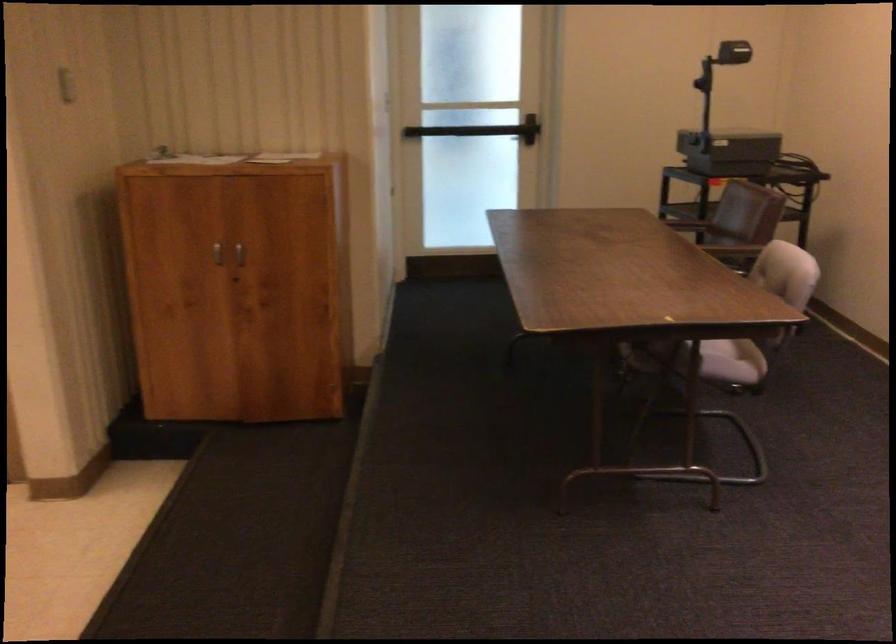
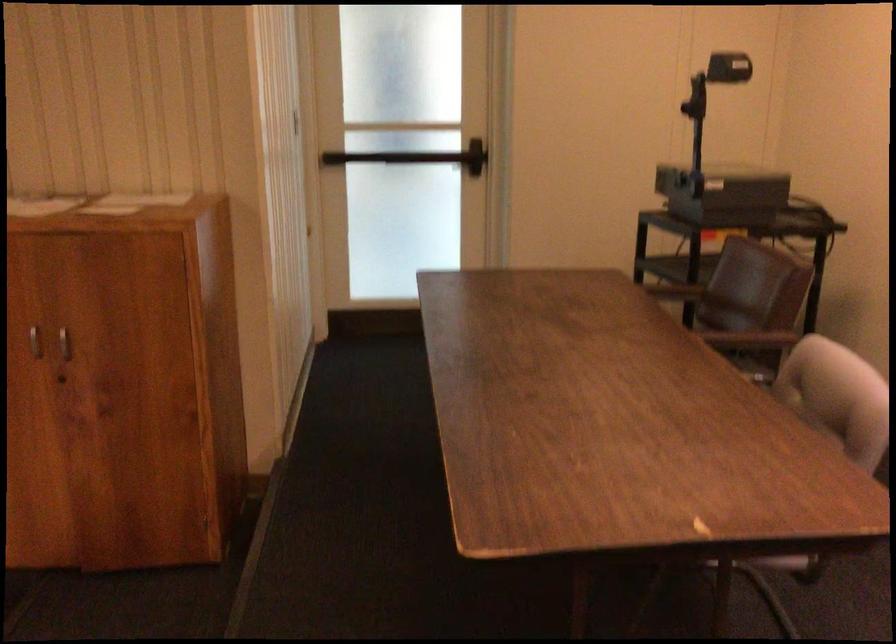
Question: In a continuous first-person perspective shot, in which direction is the camera moving?

Choices:
 (A) Left
 (B) Right
 (C) Forward
 (D) Backward

Answer: (C)